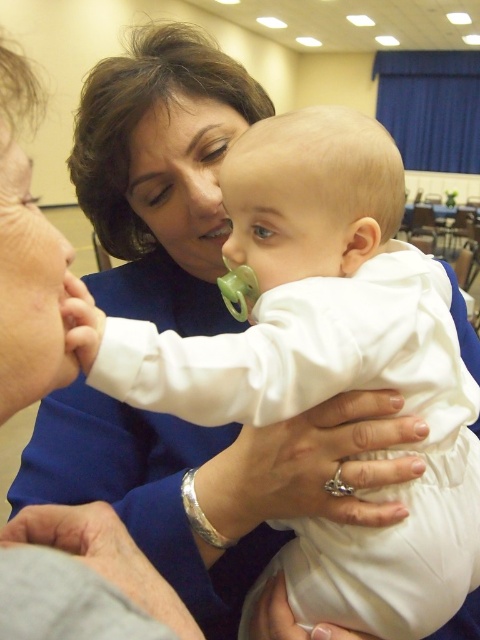
You are a photographer taking a closeup shot of the baby in the scene. The baby has two pacifiers in front of them. The white matte pacifier at center and the matte green pacifier at center. You want to focus on one pacifier while keeping the other slightly blurred. Which pacifier should you choose to focus on to ensure the other is out of focus?

The white matte pacifier at center is 11.81 inches away from the matte green pacifier at center. To achieve a blurred effect on one pacifier while focusing on the other, you should focus on whichever pacifier is closer to the camera. However, since the distance between them is significant, focusing on either would likely keep the other sufficiently out of focus depending on the lens aperture used.

You are a photographer trying to capture a closeup of the baby in the scene. You notice two items near the baby at the center. Which item is positioned closer to the camera, the white matte pacifier at center or the silver metallic teething ring at center?

The white matte pacifier at center is closer to the viewer than the silver metallic teething ring at center, so the pacifier would be closer to the camera.

You are standing in the scene and want to reach both points. Which point should you reach first, point (208, 228) or point (343, 481)?

You should reach point (208, 228) first because it is closer to you than point (343, 481).